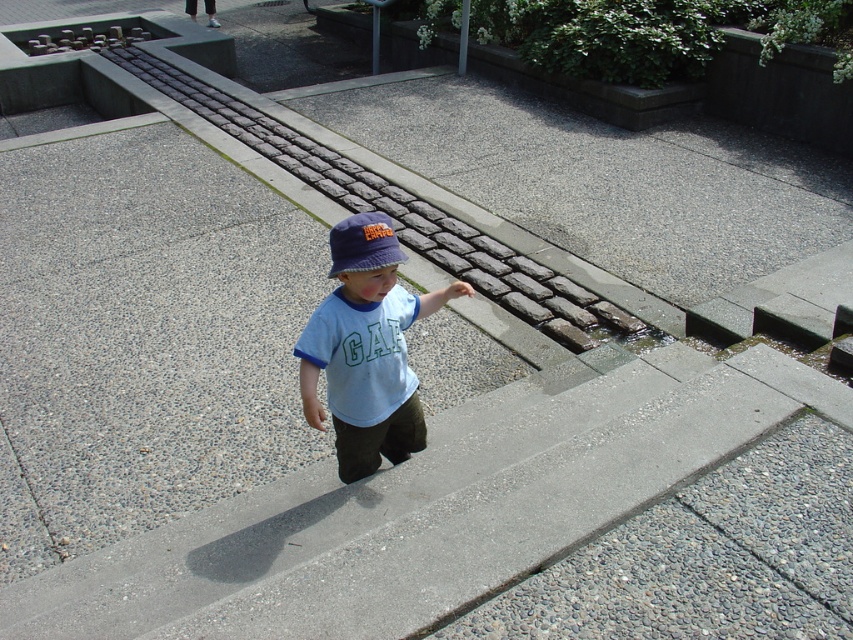
You are a photographer setting up a shot of the child wearing the light blue cotton shirt at center and the blue fabric baseball hat at center. You want to ensure both items are clearly visible in the frame. Given their size difference, which item might require closer attention to avoid being too small in the composition?

The blue fabric baseball hat at center is smaller in size compared to the light blue cotton shirt at center, so it might require closer attention to ensure it is visible and proportionate in the composition.

Based on the photo, the child is wearing a light blue cotton shirt at center and a blue fabric baseball hat at center. Which clothing item is positioned to the left?

The light blue cotton shirt at center is positioned to the left of the blue fabric baseball hat at center.

You are a photographer trying to capture a closeup of the light blue cotton shirt at center and the blue fabric baseball hat at center. What is the minimum distance you need to maintain between the camera and the subject to ensure both are in focus?

The minimum distance required is 14.34 inches because the light blue cotton shirt at center and the blue fabric baseball hat at center are 14.34 inches apart, so the camera must be at least that distance away to keep both in focus.